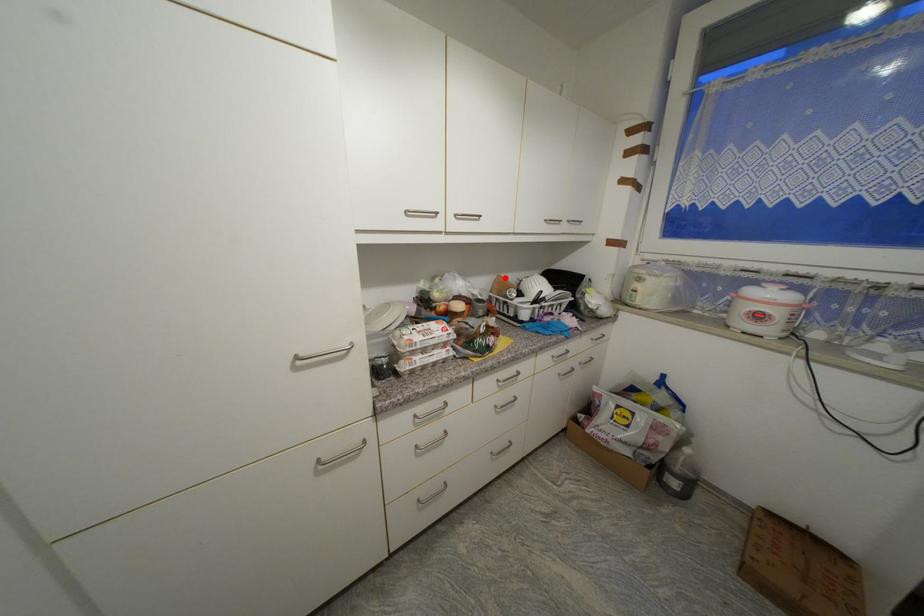
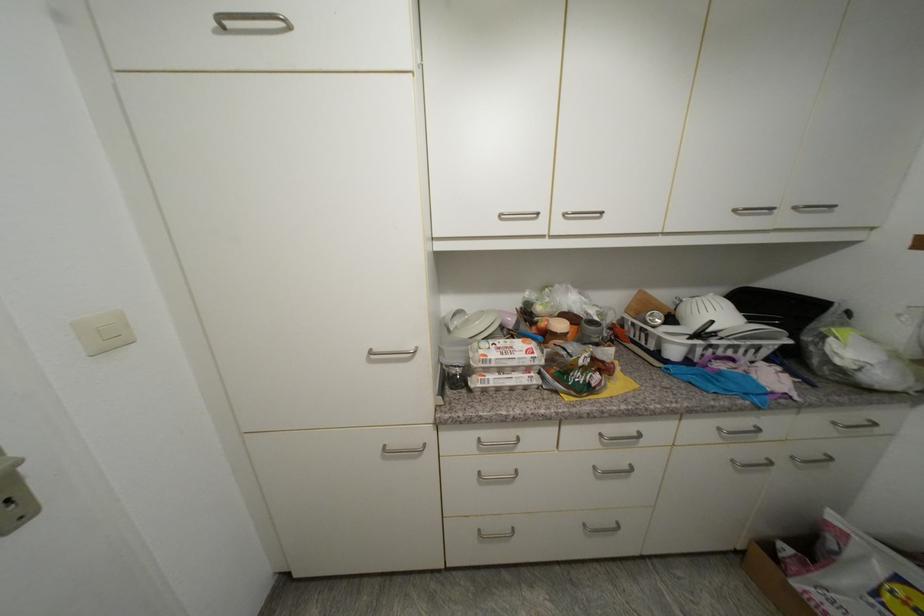
In the second image, find the point that corresponds to the highlighted location in the first image.

(647, 294)